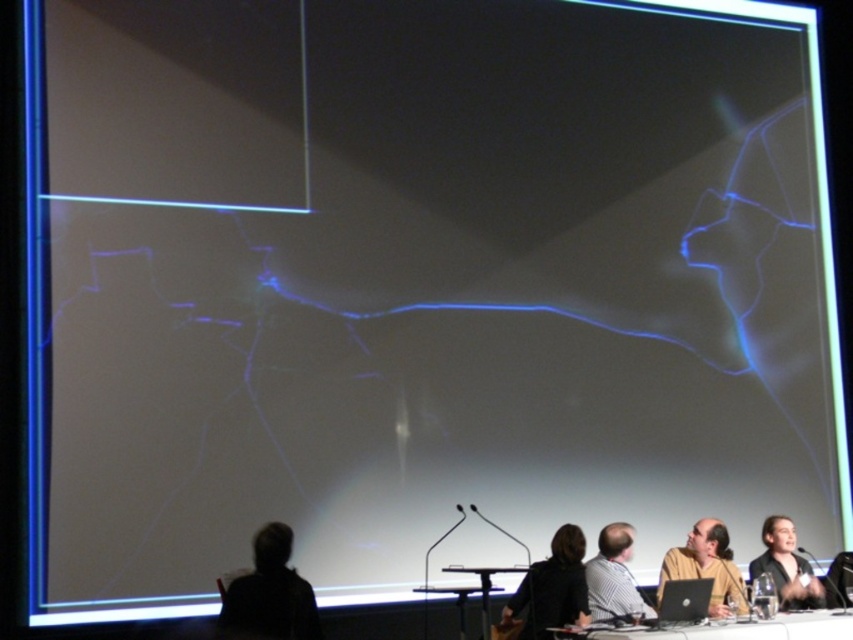
Question: Among these objects, which one is nearest to the camera?

Choices:
 (A) silhouette hair at lower left
 (B) striped fabric shirt at lower center
 (C) black plastic table at lower center

Answer: (C)

Question: Does matte brown shirt at lower right have a lesser width compared to striped fabric shirt at lower center?

Choices:
 (A) yes
 (B) no

Answer: (B)

Question: Can you confirm if silhouette hair at lower left is positioned below black plastic table at lower center?

Choices:
 (A) no
 (B) yes

Answer: (A)

Question: Which point appears farthest from the camera in this image?

Choices:
 (A) (825, 627)
 (B) (723, 586)

Answer: (B)

Question: Among these objects, which one is farthest from the camera?

Choices:
 (A) black fabric person at lower center
 (B) silhouette hair at lower left

Answer: (A)

Question: Can you confirm if black fabric person at lower center is positioned below striped fabric shirt at lower center?

Choices:
 (A) no
 (B) yes

Answer: (B)